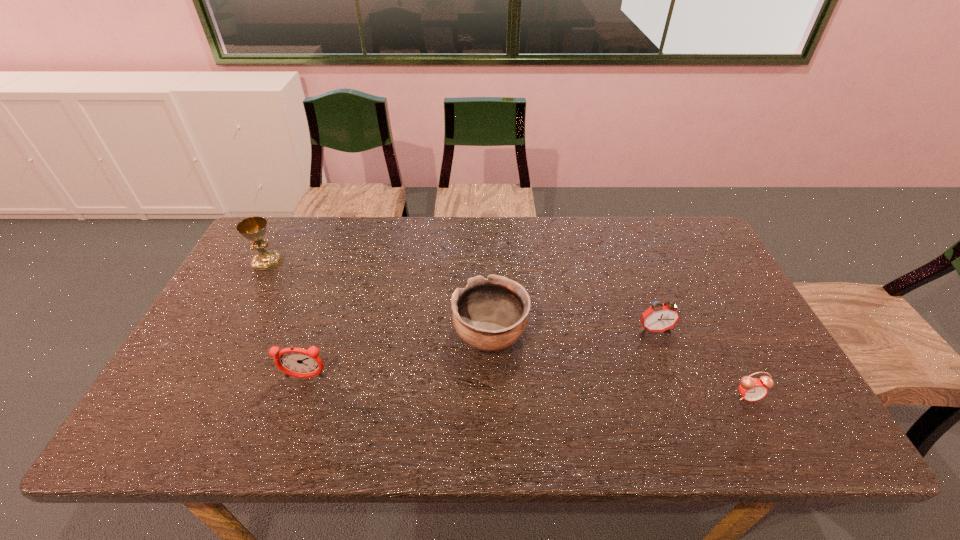
This screenshot has height=540, width=960. What are the coordinates of `the farthest object` in the screenshot? It's located at (254, 228).

Where is `chalice`? This screenshot has width=960, height=540. chalice is located at coordinates click(x=254, y=228).

Where is `pottery`? The image size is (960, 540). pottery is located at coordinates (490, 314).

The height and width of the screenshot is (540, 960). What are the coordinates of `the second farthest alarm clock` in the screenshot? It's located at (297, 362).

The width and height of the screenshot is (960, 540). What are the coordinates of `the second object from left to right` in the screenshot? It's located at (297, 362).

The width and height of the screenshot is (960, 540). I want to click on the second object from right to left, so click(659, 317).

Where is `the second alarm clock from right to left`? The width and height of the screenshot is (960, 540). the second alarm clock from right to left is located at coordinates (659, 317).

Where is `the rightmost object`? This screenshot has height=540, width=960. the rightmost object is located at coordinates (752, 389).

Where is `the shortest object`? the shortest object is located at coordinates click(752, 389).

You are a GUI agent. You are given a task and a screenshot of the screen. Output one action in this format:
    pyautogui.click(x=<x>, y=<y>)
    Task: Click on the free space located on the front of the chalice
    This screenshot has height=540, width=960.
    Given the screenshot: What is the action you would take?
    pyautogui.click(x=238, y=315)